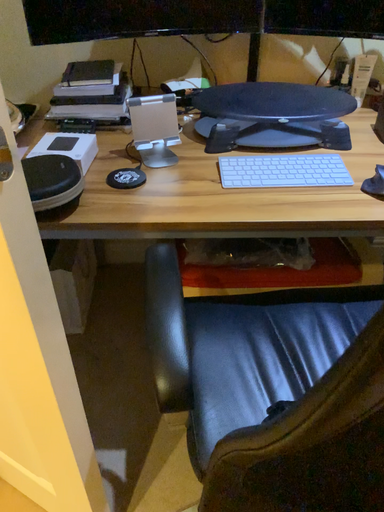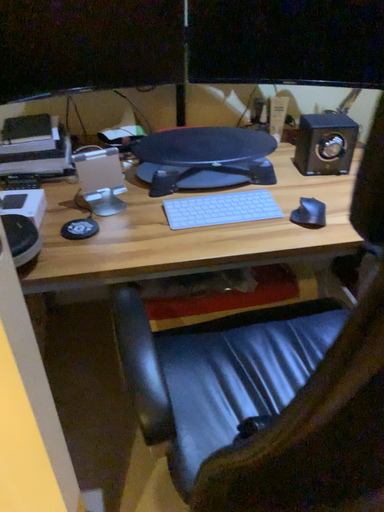
Question: How did the camera likely rotate when shooting the video?

Choices:
 (A) rotated left
 (B) rotated right

Answer: (B)